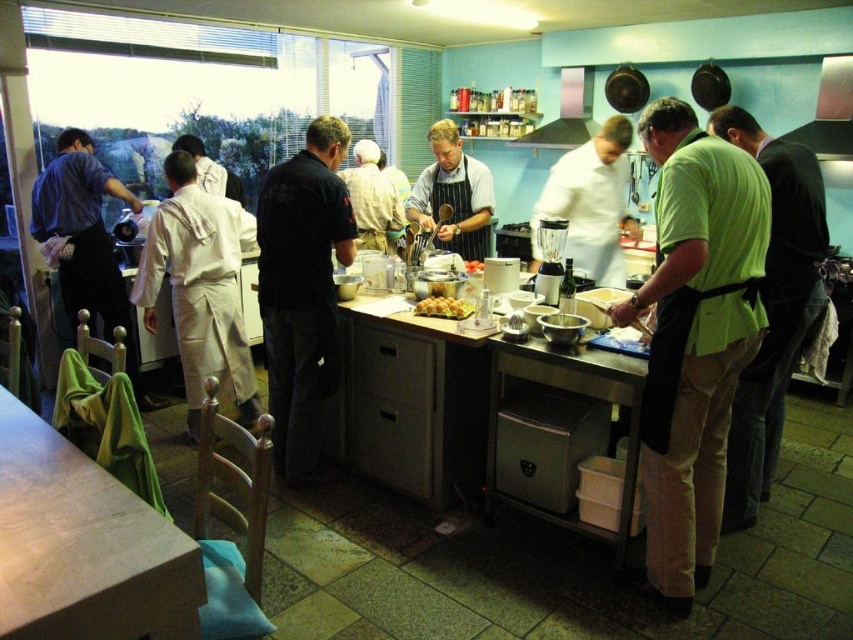
From the picture: In the kitchen scene, you notice a green apron at center and a metallic silver exhaust hood at upper right. Which object is positioned lower in the image?

The green apron at center is located below the metallic silver exhaust hood at upper right, so it is positioned lower in the image.

You are a chef trying to place the golden brown pastry at center on the counter. The counter has a space that can only accommodate items narrower than the green matte apron at center. Will the pastry fit?

The green matte apron at center is wider than the golden brown pastry at center. Since the pastry is narrower than the apron, it will fit in the space on the counter.